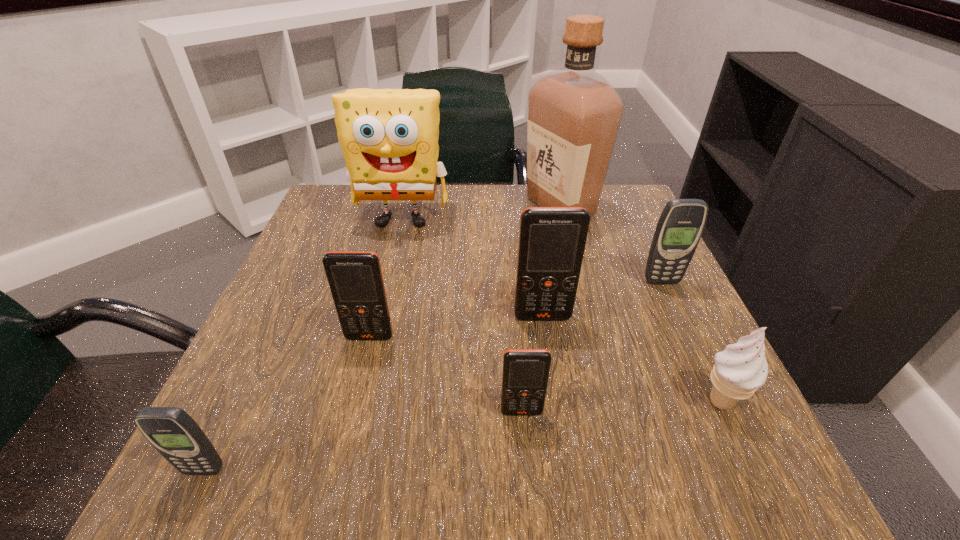
The height and width of the screenshot is (540, 960). In order to click on icecream that is at the right edge in this screenshot , I will do `click(739, 370)`.

Where is `object positioned at the far left corner`? object positioned at the far left corner is located at coordinates (389, 137).

The width and height of the screenshot is (960, 540). Identify the location of object that is at the near left corner. (173, 433).

Locate an element on the screen. object located in the far right corner section of the desktop is located at coordinates (574, 113).

Find the location of a particular element. vacant region at the far edge is located at coordinates (474, 215).

Where is `free region at the near edge of the desktop`? The height and width of the screenshot is (540, 960). free region at the near edge of the desktop is located at coordinates (468, 446).

Identify the location of free space at the left edge of the desktop. Image resolution: width=960 pixels, height=540 pixels. (305, 267).

The width and height of the screenshot is (960, 540). Identify the location of blank area at the right edge. (635, 298).

Identify the location of free point at the far left corner. The width and height of the screenshot is (960, 540). click(311, 240).

This screenshot has height=540, width=960. In order to click on vacant space at the near right corner in this screenshot , I will do `click(713, 447)`.